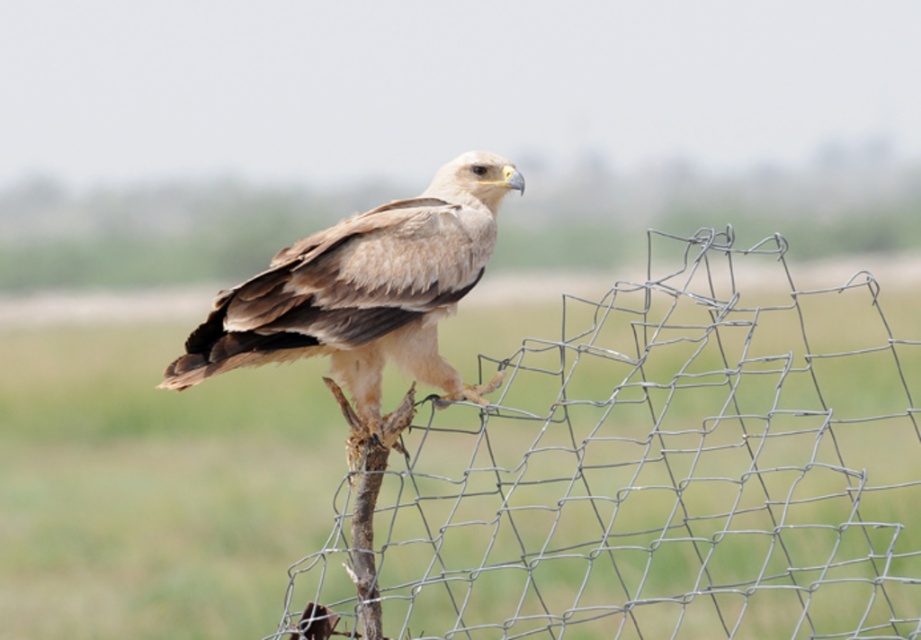
Consider the image. Can you confirm if wire mesh fence at center is positioned to the left of light brown feathered eagle at center?

Incorrect, wire mesh fence at center is not on the left side of light brown feathered eagle at center.

Between point (732, 440) and point (352, 241), which one is positioned in front?

Point (352, 241) is more forward.

Find the location of a particular element. The height and width of the screenshot is (640, 921). wire mesh fence at center is located at coordinates (651, 474).